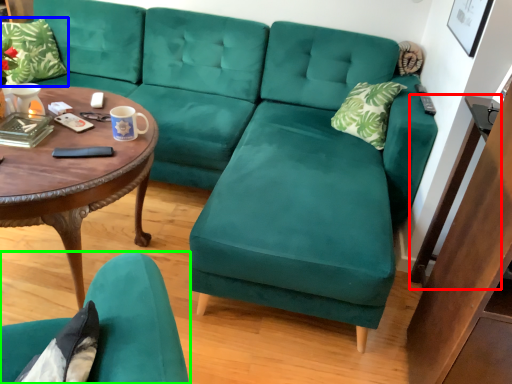
Question: Considering the real-world distances, which object is closest to side table (highlighted by a red box)? pillow (highlighted by a blue box) or chair (highlighted by a green box).

Choices:
 (A) pillow
 (B) chair

Answer: (B)